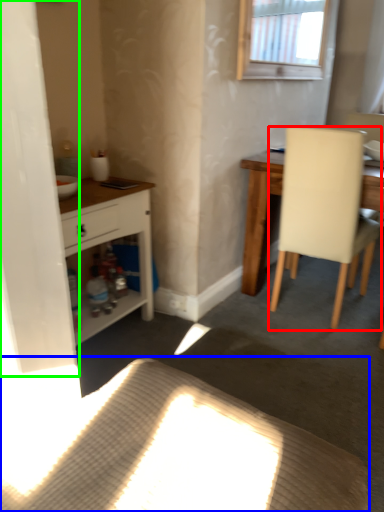
Question: Estimate the real-world distances between objects in this image. Which object is closer to chair (highlighted by a red box), plain (highlighted by a blue box) or screen door (highlighted by a green box)?

Choices:
 (A) plain
 (B) screen door

Answer: (A)